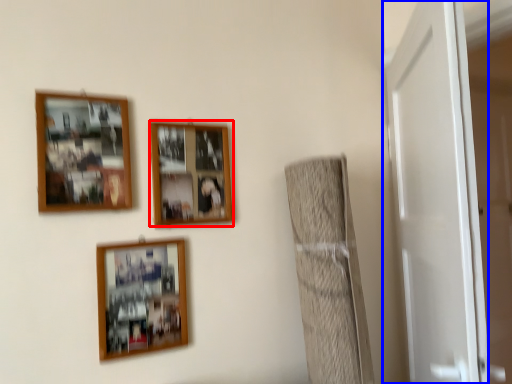
Question: Among these objects, which one is nearest to the camera, picture frame (highlighted by a red box) or door (highlighted by a blue box)?

Choices:
 (A) picture frame
 (B) door

Answer: (B)